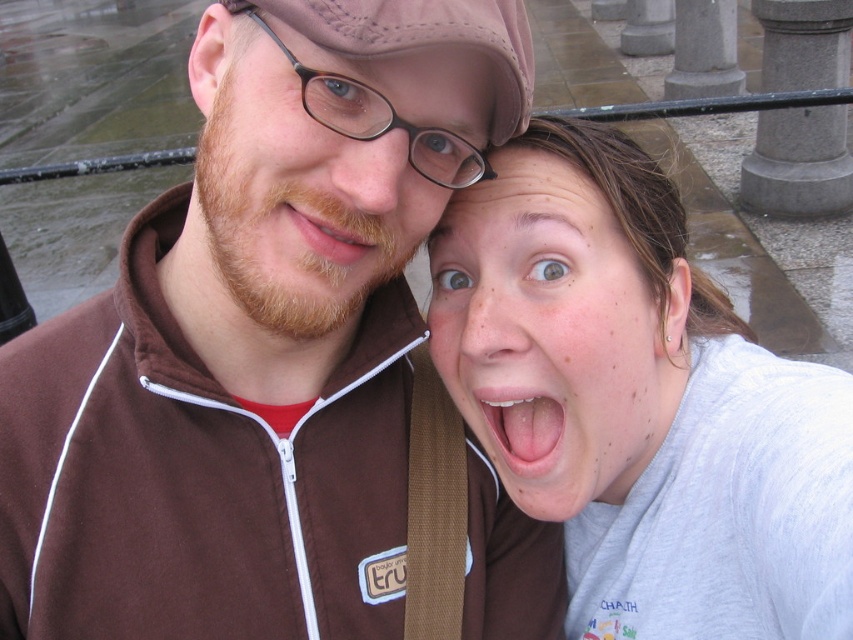
Between point (485, 358) and point (492, 412), which one is positioned behind?

The point (492, 412) is more distant.

Does pale skin at center come behind pink glossy lips at center?

No, pale skin at center is in front of pink glossy lips at center.

What do you see at coordinates (553, 333) in the screenshot? I see `pale skin at center` at bounding box center [553, 333].

Find the location of a particular element. This screenshot has height=640, width=853. pale skin at center is located at coordinates click(x=553, y=333).

Between pale skin at center and matte brown jacket at upper left, which one has less height?

With less height is matte brown jacket at upper left.

Looking at this image, does pale skin at center appear on the right side of matte brown jacket at upper left?

Indeed, pale skin at center is positioned on the right side of matte brown jacket at upper left.

What do you see at coordinates (553, 333) in the screenshot? I see `pale skin at center` at bounding box center [553, 333].

Locate an element on the screen. This screenshot has width=853, height=640. pale skin at center is located at coordinates point(553,333).

Locate an element on the screen. The width and height of the screenshot is (853, 640). brown matte beard at center is located at coordinates (329, 228).

Is point (386, 234) more distant than point (497, 412)?

No, (386, 234) is in front of (497, 412).

At what (x,y) coordinates should I click in order to perform the action: click on brown matte beard at center. Please return your answer as a coordinate pair (x, y). The height and width of the screenshot is (640, 853). Looking at the image, I should click on (329, 228).